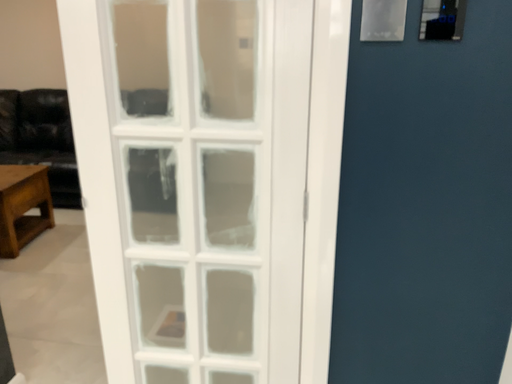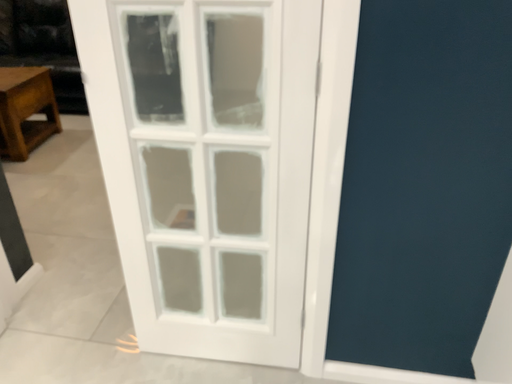
Question: How did the camera likely rotate when shooting the video?

Choices:
 (A) rotated upward
 (B) rotated downward

Answer: (B)